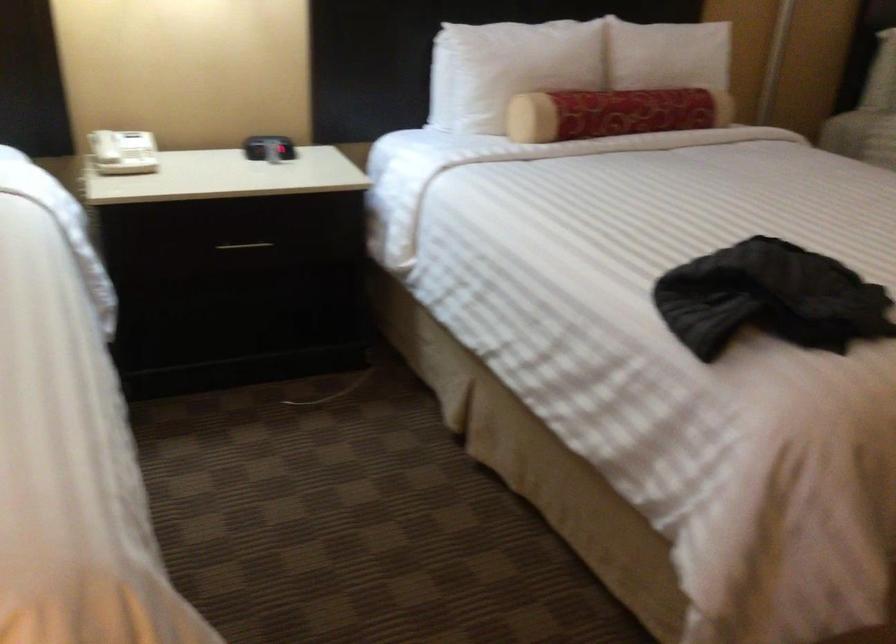
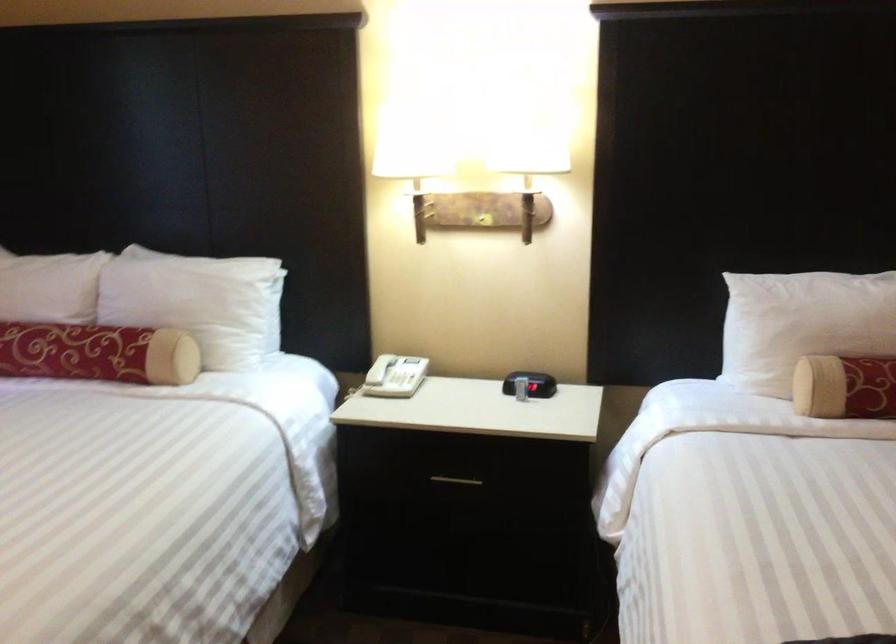
Find the pixel in the second image that matches (144,158) in the first image.

(405, 380)